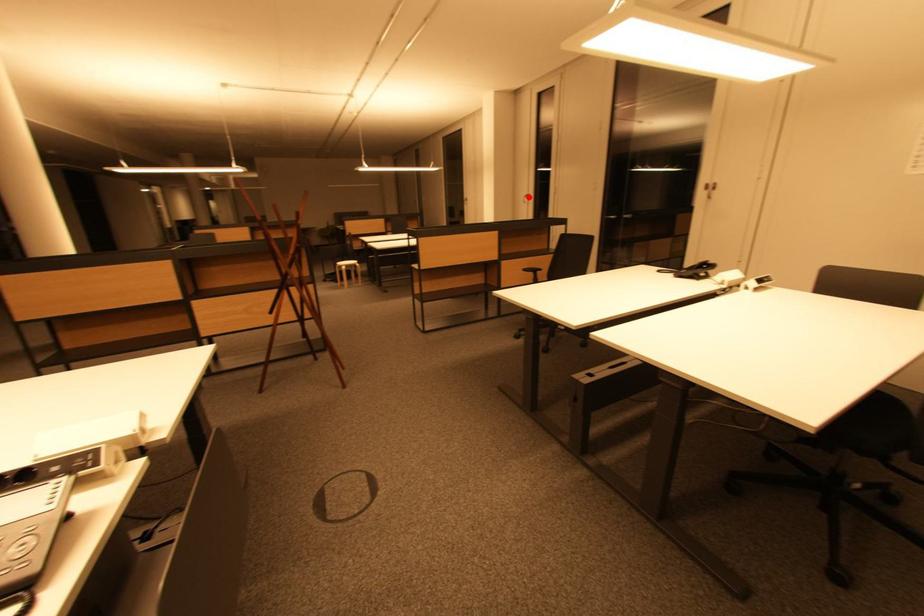
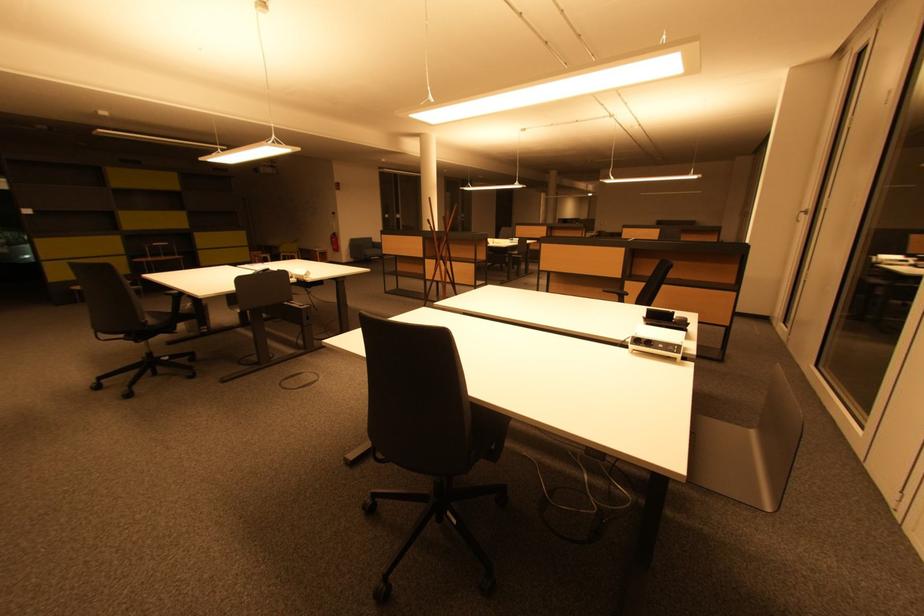
Question: I am providing you with two images of the same scene from different viewpoints. A red point is shown in image1. For the corresponding object point in image2, is it positioned nearer or farther from the camera?

Choices:
 (A) Nearer
 (B) Farther

Answer: (B)